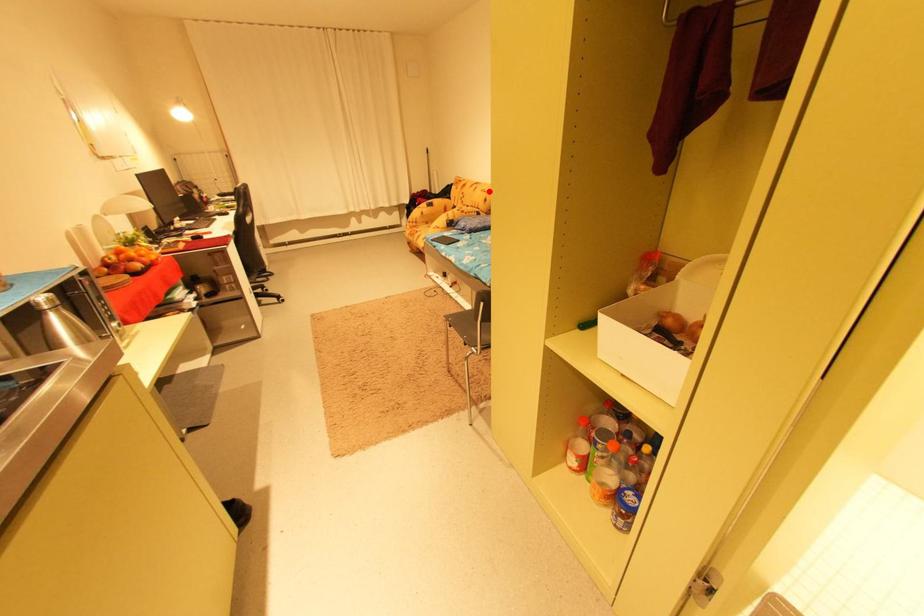
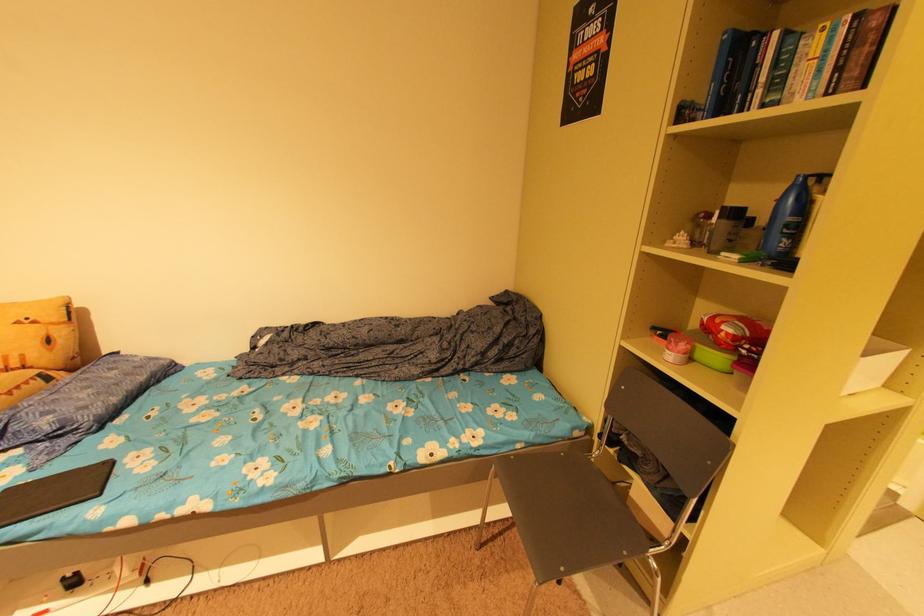
Find the pixel in the second image that matches the highlighted location in the first image.

(23, 323)